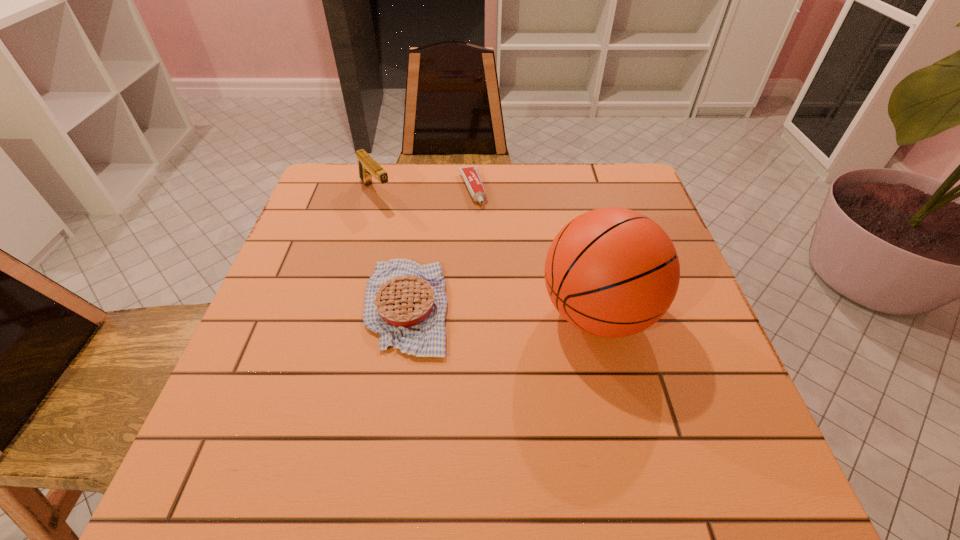
Find the location of a particular element. This screenshot has height=540, width=960. free space located 0.100m at the barrel of the pistol is located at coordinates (402, 225).

Find the location of a particular element. This screenshot has width=960, height=540. vacant region located at the nozzle of the third object from left to right is located at coordinates (500, 273).

The image size is (960, 540). Find the location of `blank space located at the nozzle of the third object from left to right`. blank space located at the nozzle of the third object from left to right is located at coordinates (486, 237).

Where is `blank area located at the nozzle of the third object from left to right`? This screenshot has height=540, width=960. blank area located at the nozzle of the third object from left to right is located at coordinates (492, 249).

I want to click on pistol that is positioned at the far edge, so click(368, 167).

This screenshot has height=540, width=960. I want to click on toothpaste positioned at the far edge, so click(470, 174).

Find the location of `object present at the left edge`. object present at the left edge is located at coordinates (368, 167).

You are a GUI agent. You are given a task and a screenshot of the screen. Output one action in this format:
    pyautogui.click(x=<x>, y=<y>)
    Task: Click on the object at the right edge
    The width and height of the screenshot is (960, 540).
    Given the screenshot: What is the action you would take?
    pyautogui.click(x=612, y=272)

Find the location of a particular element. The image size is (960, 540). object that is positioned at the far left corner is located at coordinates (368, 167).

You are a GUI agent. You are given a task and a screenshot of the screen. Output one action in this format:
    pyautogui.click(x=<x>, y=<y>)
    Task: Click on the vacant area at the far edge
    Image resolution: width=960 pixels, height=540 pixels.
    Given the screenshot: What is the action you would take?
    pyautogui.click(x=445, y=176)